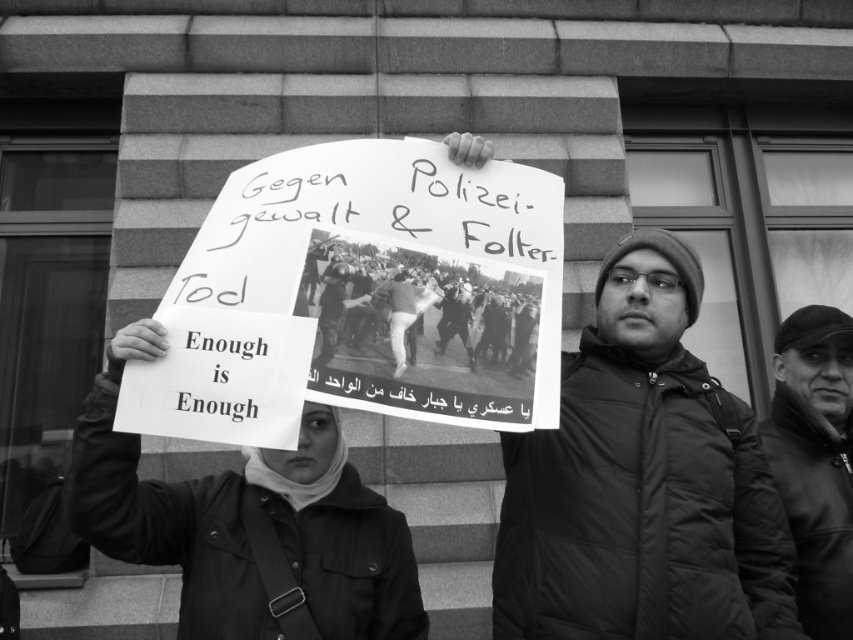
Based on the scene described, which object is positioned higher up between the matte black jacket at center and the dark fabric jacket at center?

The matte black jacket at center is positioned higher up than the dark fabric jacket at center.

You are a photographer analyzing this protest scene. You notice a point at coordinates (642, 483). What object is located at this point?

The object at point (642, 483) is the matte black jacket at center.

Based on the scene description, where is the matte black jacket at center located in terms of coordinates?

The matte black jacket at center is located at point coordinates of (642, 483).